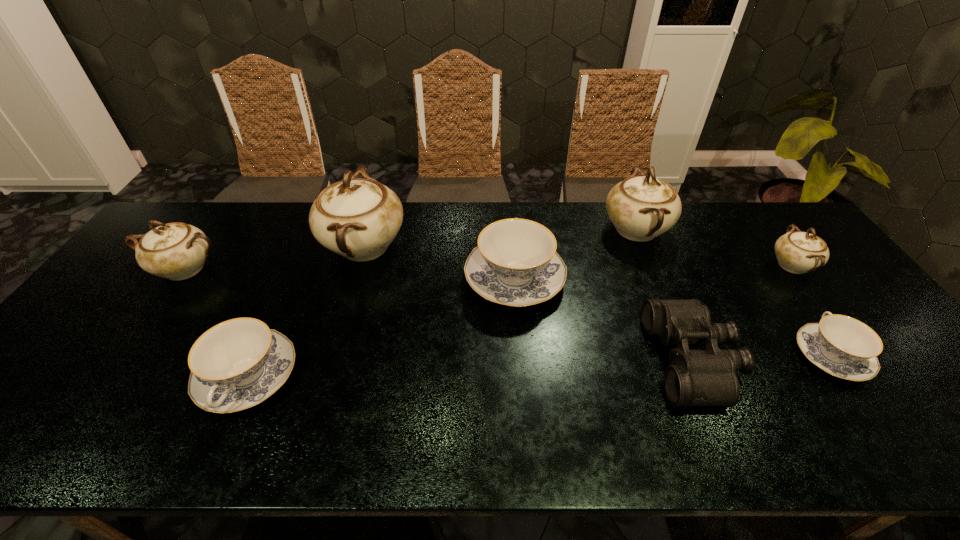
At what (x,y) coordinates should I click in order to perform the action: click on free point between the leftmost white chinaware and the second blue chinaware from right to left. Please return your answer as a coordinate pair (x, y). Looking at the image, I should click on (349, 274).

Find the location of a particular element. The image size is (960, 540). free space between the rightmost white chinaware and the fourth chinaware from left to right is located at coordinates (653, 272).

Image resolution: width=960 pixels, height=540 pixels. I want to click on free point between the shortest object and the rightmost white chinaware, so click(811, 310).

What are the coordinates of `free area in between the biggest white chinaware and the leftmost blue chinaware` in the screenshot? It's located at (306, 312).

Find the location of `free space that is in between the fourth chinaware from right to left and the smallest white chinaware`. free space that is in between the fourth chinaware from right to left and the smallest white chinaware is located at coordinates (653, 272).

I want to click on object that is the fourth closest one to the sixth shortest object, so click(x=641, y=208).

You are a GUI agent. You are given a task and a screenshot of the screen. Output one action in this format:
    pyautogui.click(x=<x>, y=<y>)
    Task: Click on the object that can be found as the closest to the rightmost white chinaware
    
    Given the screenshot: What is the action you would take?
    pyautogui.click(x=844, y=347)

Point out which chinaware is positioned as the third nearest to the leftmost chinaware. Please provide its 2D coordinates. Your answer should be formatted as a tuple, i.e. [(x, y)], where the tuple contains the x and y coordinates of a point satisfying the conditions above.

[(516, 264)]

Locate which chinaware ranks fourth in proximity to the seventh shortest object. Please provide its 2D coordinates. Your answer should be formatted as a tuple, i.e. [(x, y)], where the tuple contains the x and y coordinates of a point satisfying the conditions above.

[(358, 218)]

At what (x,y) coordinates should I click in order to perform the action: click on white chinaware object that ranks as the third closest to the rightmost blue chinaware. Please return your answer as a coordinate pair (x, y). This screenshot has height=540, width=960. Looking at the image, I should click on (358, 218).